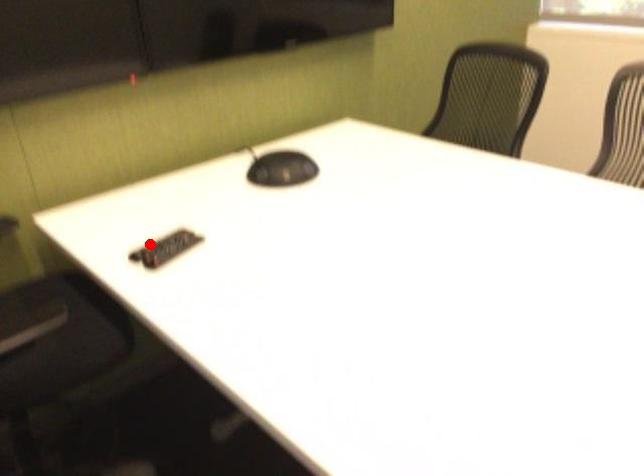
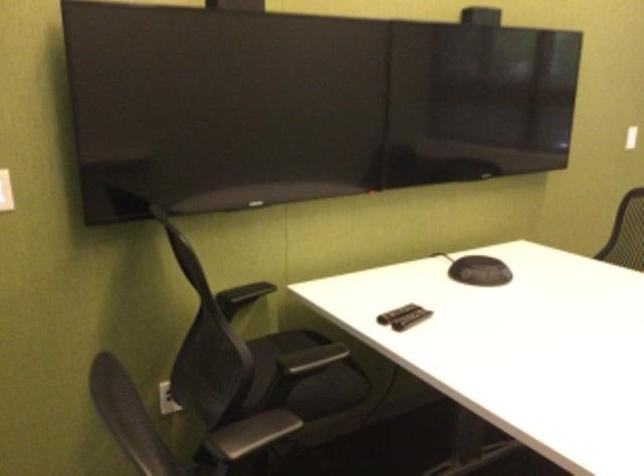
Question: I am providing you with two images of the same scene from different viewpoints. In image1, a red point is highlighted. Considering the same 3D point in image2, which of the following is correct?

Choices:
 (A) It is closer
 (B) It is farther

Answer: (B)